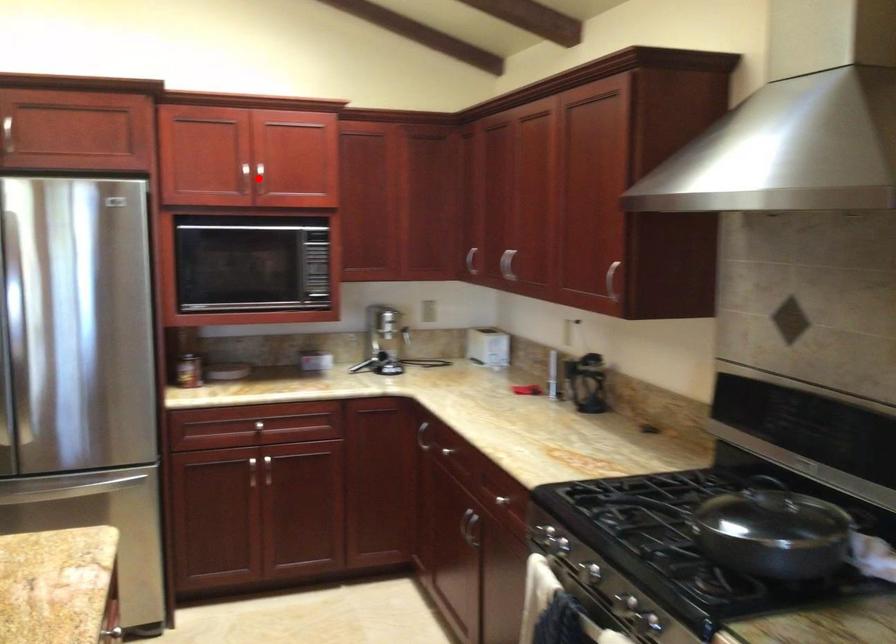
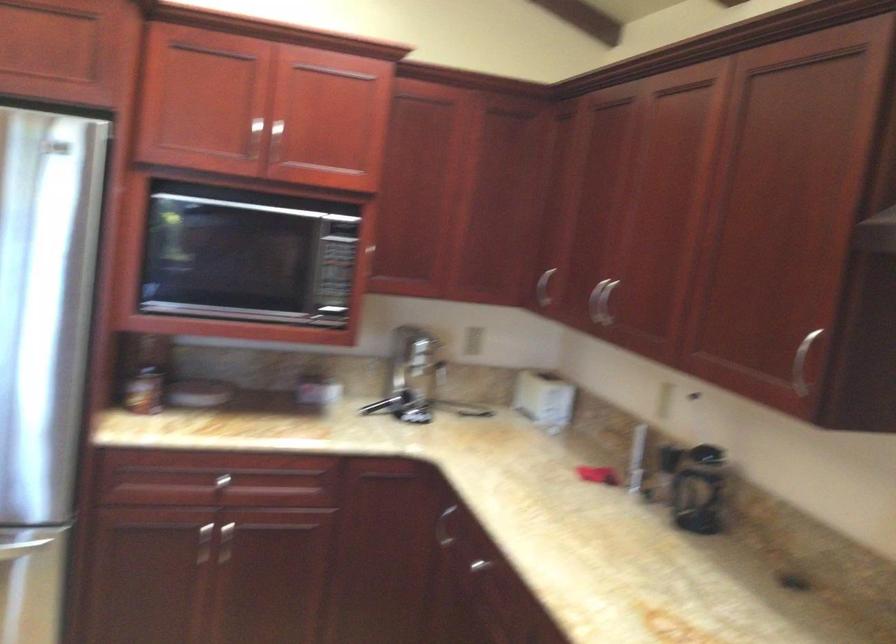
Question: I am providing you with two images of the same scene from different viewpoints. Given a red point in image1, look at the same physical point in image2. Is it:

Choices:
 (A) Closer to the viewpoint
 (B) Farther from the viewpoint

Answer: (A)